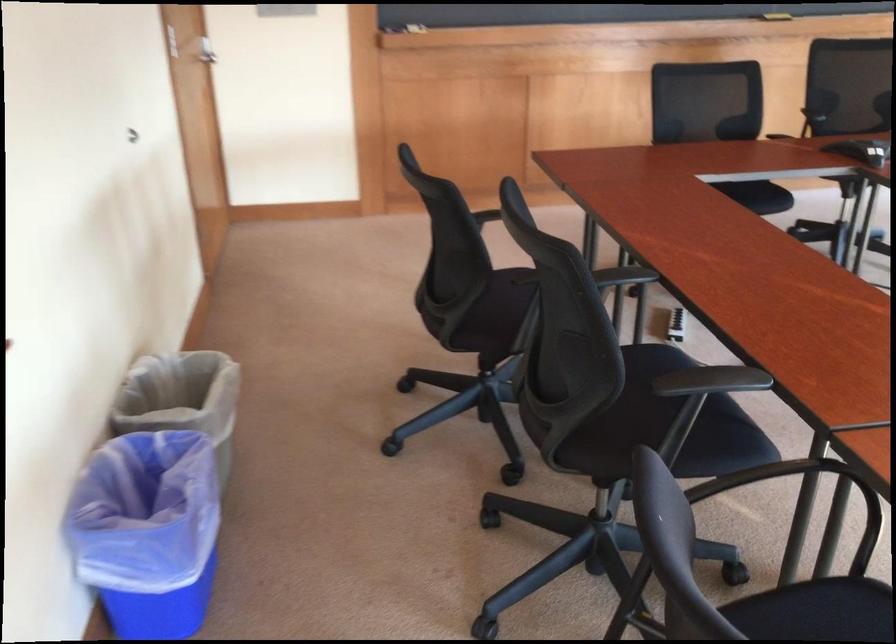
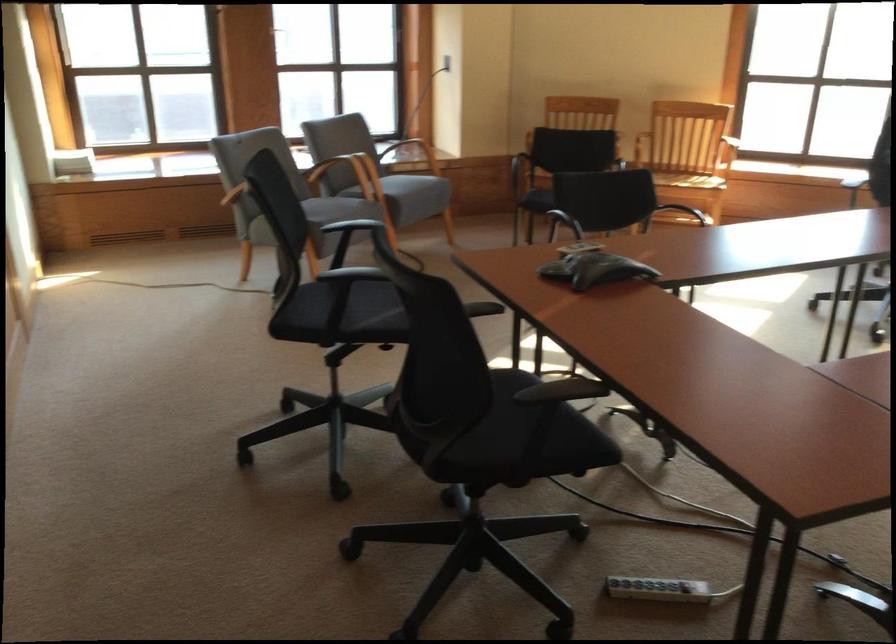
Question: I am providing you with two images of the same scene from different viewpoints. Please identify which objects are invisible in image2.

Choices:
 (A) black chair armrest
 (B) grey chair sitting surface
 (C) black chair sitting surface
 (D) light switch

Answer: (C)